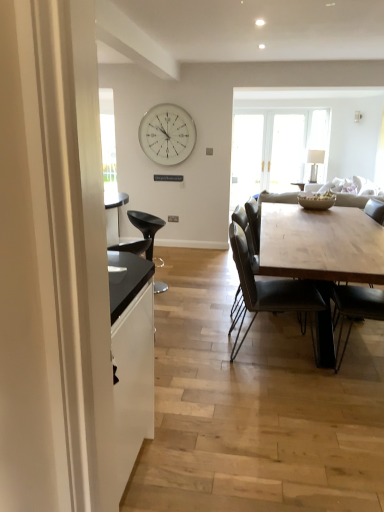
Question: Should I look upward or downward to see leather couch at center?

Choices:
 (A) up
 (B) down

Answer: (A)

Question: Is natural wood table at center outside of white glass clock at upper center?

Choices:
 (A) no
 (B) yes

Answer: (B)

Question: Is natural wood table at center oriented towards white glass clock at upper center?

Choices:
 (A) yes
 (B) no

Answer: (B)

Question: Is natural wood table at center to the right of white glass clock at upper center from the viewer's perspective?

Choices:
 (A) yes
 (B) no

Answer: (A)

Question: Is natural wood table at center next to white glass clock at upper center and touching it?

Choices:
 (A) no
 (B) yes

Answer: (A)

Question: Does natural wood table at center have a greater height compared to white glass clock at upper center?

Choices:
 (A) no
 (B) yes

Answer: (A)

Question: Is natural wood table at center to the left of white glass clock at upper center from the viewer's perspective?

Choices:
 (A) no
 (B) yes

Answer: (A)

Question: Is the depth of leather couch at center greater than that of dark gray leather chair at center, marked as the second chair in a back-to-front arrangement?

Choices:
 (A) yes
 (B) no

Answer: (A)

Question: Considering the relative sizes of leather couch at center and dark gray leather chair at center, which is the second chair from left to right, in the image provided, is leather couch at center taller than dark gray leather chair at center, which is the second chair from left to right,?

Choices:
 (A) no
 (B) yes

Answer: (A)

Question: Considering the relative sizes of leather couch at center and dark gray leather chair at center, the second chair positioned from the right, in the image provided, is leather couch at center bigger than dark gray leather chair at center, the second chair positioned from the right,?

Choices:
 (A) no
 (B) yes

Answer: (B)

Question: Is dark gray leather chair at center, the second chair positioned from the right, a part of leather couch at center?

Choices:
 (A) yes
 (B) no

Answer: (B)

Question: Is leather couch at center oriented away from dark gray leather chair at center, marked as the second chair in a back-to-front arrangement?

Choices:
 (A) yes
 (B) no

Answer: (B)

Question: From a real-world perspective, is leather couch at center on dark gray leather chair at center, the second chair in the front-to-back sequence?

Choices:
 (A) yes
 (B) no

Answer: (A)

Question: Is natural wood table at center to the left of leather couch at center from the viewer's perspective?

Choices:
 (A) no
 (B) yes

Answer: (B)